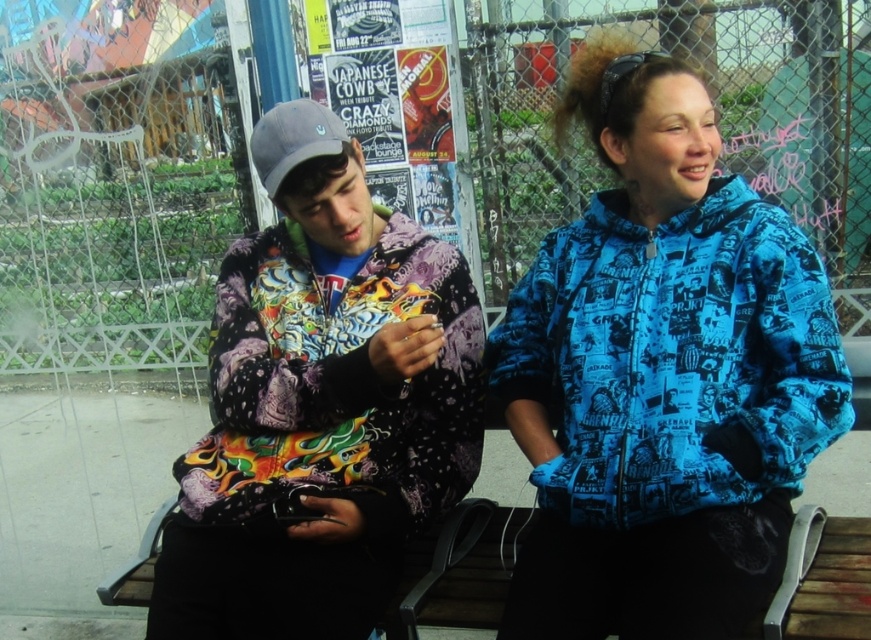
You are standing 5 feet away from the bench where the two people are sitting. There is a point at coordinates point (281, 404). Can you reach that point without moving closer than 4 feet to the bench?

The distance of point (281, 404) from viewer is 4.10 feet, so you are currently 5 feet away. Since 4.10 feet is less than 5 feet, you can reach that point without moving closer than 4 feet to the bench because you are already 5 feet away and the point is only 4.10 feet away from your current position.

You are a photographer trying to capture a candid shot of the two people on the bench. You have a camera with a lens that has a minimum focusing distance of 10 inches. Can you take a clear photo of both the printed fabric hoodie at left and the blue printed jacket at upper right without moving your position?

The printed fabric hoodie at left is 11.43 inches away from the blue printed jacket at upper right. Since the minimum focusing distance of your camera lens is 10 inches, you can take a clear photo of both the printed fabric hoodie at left and the blue printed jacket at upper right without moving your position because the distance between them is within the lens capability.

You are a fashion designer analyzing the image. You need to identify the exact location of the point with coordinates [321,404]. Which clothing item does this point belong to?

The point with coordinates [321,404] is located on the printed fabric hoodie at left.